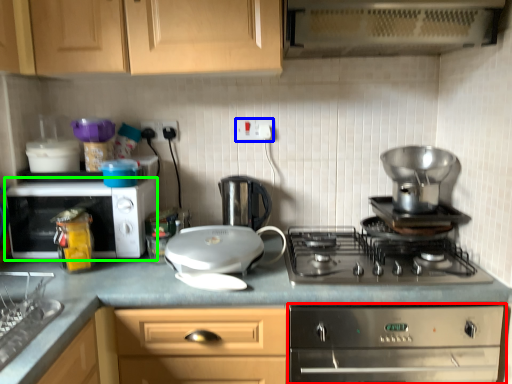
Question: Which object is the farthest from home appliance (highlighted by a red box)? Choose among these: electric outlet (highlighted by a blue box) or microwave oven (highlighted by a green box).

Choices:
 (A) electric outlet
 (B) microwave oven

Answer: (A)